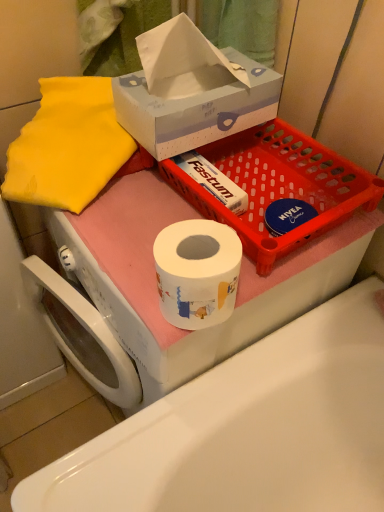
Locate an element on the screen. This screenshot has width=384, height=512. white cardboard tissue box at upper center is located at coordinates (197, 106).

What do you see at coordinates (279, 186) in the screenshot? I see `matte plastic basket at upper center` at bounding box center [279, 186].

Where is `white cardboard tissue box at upper center`? The width and height of the screenshot is (384, 512). white cardboard tissue box at upper center is located at coordinates (197, 106).

Is matte plastic basket at upper center positioned with its back to white cardboard tissue box at upper center?

No.

Identify the location of box lying in front of the matte plastic basket at upper center. Image resolution: width=384 pixels, height=512 pixels. (197, 106).

Is point (296, 137) closer to camera compared to point (153, 146)?

That is False.

Is white cardboard tissue box at upper center to the left of white glossy toilet paper at center from the viewer's perspective?

No, white cardboard tissue box at upper center is not to the left of white glossy toilet paper at center.

From a real-world perspective, which is physically above, white cardboard tissue box at upper center or white glossy toilet paper at center?

white cardboard tissue box at upper center is physically above.

Is white cardboard tissue box at upper center not within white glossy toilet paper at center?

Absolutely, white cardboard tissue box at upper center is external to white glossy toilet paper at center.

Considering the relative sizes of white cardboard tissue box at upper center and white glossy toilet paper at center in the image provided, is white cardboard tissue box at upper center taller than white glossy toilet paper at center?

No, white cardboard tissue box at upper center is not taller than white glossy toilet paper at center.

From a real-world perspective, is white glossy toilet paper at center above or below white cardboard tissue box at upper center?

white glossy toilet paper at center is below white cardboard tissue box at upper center.

Does white glossy toilet paper at center come behind white cardboard tissue box at upper center?

No, it is in front of white cardboard tissue box at upper center.

How far apart are white glossy toilet paper at center and white cardboard tissue box at upper center?

They are 17.63 inches apart.

Is point (344, 501) closer to viewer compared to point (230, 108)?

No, it is not.

Can you tell me how much white cardboard tissue box at upper center and matte plastic basket at upper center differ in facing direction?

white cardboard tissue box at upper center and matte plastic basket at upper center are facing 0.000795 degrees away from each other.

Which is in front, white cardboard tissue box at upper center or matte plastic basket at upper center?

white cardboard tissue box at upper center is closer to the camera.

From the image's perspective, is white cardboard tissue box at upper center above matte plastic basket at upper center?

Yes, from the image's perspective, white cardboard tissue box at upper center is above matte plastic basket at upper center.

From a real-world perspective, is white cardboard tissue box at upper center on top of matte plastic basket at upper center?

Yes.

From the image's perspective, which is above, matte plastic basket at upper center or white glossy toilet paper at center?

matte plastic basket at upper center.

From a real-world perspective, is matte plastic basket at upper center on top of white glossy toilet paper at center?

Yes, from a real-world perspective, matte plastic basket at upper center is above white glossy toilet paper at center.

What's the angular difference between matte plastic basket at upper center and white glossy toilet paper at center's facing directions?

They differ by 0.886 degrees in their facing directions.

Considering the sizes of objects matte plastic basket at upper center and white glossy toilet paper at center in the image provided, who is taller, matte plastic basket at upper center or white glossy toilet paper at center?

With more height is white glossy toilet paper at center.

From a real-world perspective, is white glossy toilet paper at center located beneath matte plastic basket at upper center?

Yes.

Could you tell me if white glossy toilet paper at center is facing matte plastic basket at upper center?

No, white glossy toilet paper at center is not facing towards matte plastic basket at upper center.

Which is farther from the camera, (308, 317) or (244, 175)?

The point (244, 175) is farther.

Between white glossy toilet paper at center and matte plastic basket at upper center, which one appears on the left side from the viewer's perspective?

white glossy toilet paper at center is more to the left.

This screenshot has height=512, width=384. I want to click on box in front of the matte plastic basket at upper center, so click(x=197, y=106).

Find the location of a particular element. The image size is (384, 512). box on the right of white glossy toilet paper at center is located at coordinates (197, 106).

Considering their positions, is white cardboard tissue box at upper center positioned closer to white glossy toilet paper at center than matte plastic basket at upper center?

matte plastic basket at upper center.

Looking at the image, which one is located closer to white cardboard tissue box at upper center, matte plastic basket at upper center or white glossy toilet paper at center?

matte plastic basket at upper center.

From the image, which object appears to be nearer to matte plastic basket at upper center, white glossy toilet paper at center or white cardboard tissue box at upper center?

white cardboard tissue box at upper center is closer to matte plastic basket at upper center.

Looking at the image, which one is located further to white cardboard tissue box at upper center, white glossy toilet paper at center or matte plastic basket at upper center?

white glossy toilet paper at center is further to white cardboard tissue box at upper center.

From the image, which object appears to be nearer to white glossy toilet paper at center, matte plastic basket at upper center or white cardboard tissue box at upper center?

Based on the image, matte plastic basket at upper center appears to be nearer to white glossy toilet paper at center.

When comparing their distances from matte plastic basket at upper center, does white cardboard tissue box at upper center or white glossy toilet paper at center seem further?

white glossy toilet paper at center.

This screenshot has height=512, width=384. I want to click on basket between white cardboard tissue box at upper center and white glossy toilet paper at center in the vertical direction, so click(x=279, y=186).